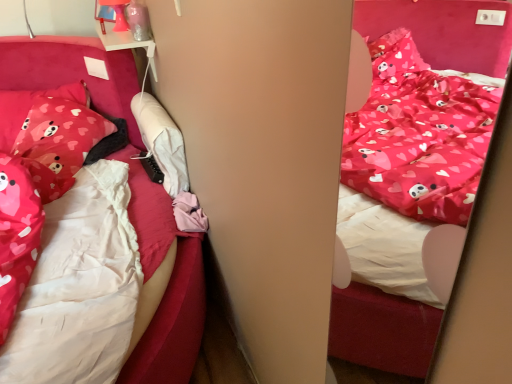
Question: Is matte pink pillow with heart patterns at left, the 1th pillow positioned from the left, a part of matte pink pillow with heart patterns at left, which is the 2th pillow from left to right?

Choices:
 (A) no
 (B) yes

Answer: (A)

Question: Is matte pink pillow with heart patterns at left, arranged as the first pillow when viewed from the right, turned away from matte pink pillow with heart patterns at left, the 1th pillow positioned from the left?

Choices:
 (A) no
 (B) yes

Answer: (B)

Question: Is matte pink pillow with heart patterns at left, arranged as the first pillow when viewed from the right, positioned before matte pink pillow with heart patterns at left, the 1th pillow positioned from the left?

Choices:
 (A) yes
 (B) no

Answer: (A)

Question: Is matte pink pillow with heart patterns at left, arranged as the first pillow when viewed from the right, to the left of matte pink pillow with heart patterns at left, the 2th pillow viewed from the right, from the viewer's perspective?

Choices:
 (A) no
 (B) yes

Answer: (A)

Question: Is matte pink pillow with heart patterns at left, arranged as the first pillow when viewed from the right, outside matte pink pillow with heart patterns at left, the 1th pillow positioned from the left?

Choices:
 (A) no
 (B) yes

Answer: (A)

Question: Relative to matte pink pillow with heart patterns at left, which is the 2th pillow from left to right, is matte pink pillow with heart patterns at left, the 1th pillow positioned from the left, in front or behind?

Choices:
 (A) behind
 (B) front

Answer: (A)

Question: From the image's perspective, is matte pink pillow with heart patterns at left, the 2th pillow viewed from the right, above or below matte pink pillow with heart patterns at left, arranged as the first pillow when viewed from the right?

Choices:
 (A) below
 (B) above

Answer: (B)

Question: In the image, is matte pink pillow with heart patterns at left, the 2th pillow viewed from the right, on the left side or the right side of matte pink pillow with heart patterns at left, which is the 2th pillow from left to right?

Choices:
 (A) left
 (B) right

Answer: (A)

Question: From a real-world perspective, is matte pink pillow with heart patterns at left, the 1th pillow positioned from the left, physically located above or below matte pink pillow with heart patterns at left, which is the 2th pillow from left to right?

Choices:
 (A) above
 (B) below

Answer: (A)

Question: Is matte pink pillow with heart patterns at left, arranged as the first pillow when viewed from the right, inside the boundaries of matte pink pillow with heart patterns at left, the 1th pillow positioned from the left, or outside?

Choices:
 (A) inside
 (B) outside

Answer: (A)

Question: In the image, is matte pink pillow with heart patterns at left, arranged as the first pillow when viewed from the right, on the left side or the right side of matte pink pillow with heart patterns at left, the 2th pillow viewed from the right?

Choices:
 (A) right
 (B) left

Answer: (A)

Question: Is matte pink pillow with heart patterns at left, which is the 2th pillow from left to right, wider or thinner than matte pink pillow with heart patterns at left, the 2th pillow viewed from the right?

Choices:
 (A) thin
 (B) wide

Answer: (A)

Question: Considering the positions of matte pink pillow with heart patterns at left, which is the 2th pillow from left to right, and matte pink pillow with heart patterns at left, the 2th pillow viewed from the right, in the image, is matte pink pillow with heart patterns at left, which is the 2th pillow from left to right, bigger or smaller than matte pink pillow with heart patterns at left, the 2th pillow viewed from the right,?

Choices:
 (A) big
 (B) small

Answer: (B)

Question: Is matte pink pillow with heart patterns at left, the 1th pillow positioned from the left, taller or shorter than matte pink fabric bed at center?

Choices:
 (A) tall
 (B) short

Answer: (B)

Question: Is matte pink pillow with heart patterns at left, the 2th pillow viewed from the right, in front of or behind matte pink fabric bed at center in the image?

Choices:
 (A) front
 (B) behind

Answer: (B)